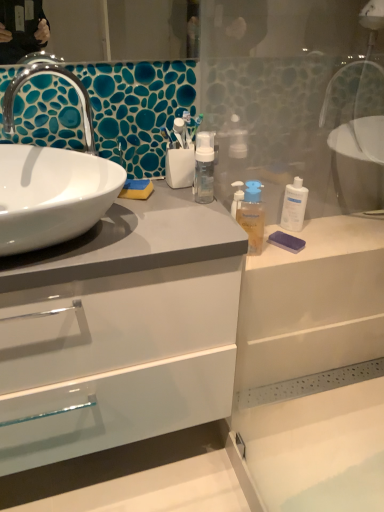
Question: From the image's perspective, does purple matte bar of soap at right appear lower than white glossy sink at left?

Choices:
 (A) no
 (B) yes

Answer: (B)

Question: Can you confirm if purple matte bar of soap at right is positioned to the left of white glossy sink at left?

Choices:
 (A) no
 (B) yes

Answer: (A)

Question: Is purple matte bar of soap at right closer to the viewer compared to white glossy sink at left?

Choices:
 (A) yes
 (B) no

Answer: (B)

Question: Does purple matte bar of soap at right have a greater height compared to white glossy sink at left?

Choices:
 (A) no
 (B) yes

Answer: (A)

Question: Does purple matte bar of soap at right have a lesser width compared to white glossy sink at left?

Choices:
 (A) no
 (B) yes

Answer: (B)

Question: Would you say white glossy cabinet at left is to the left or to the right of white glossy sink at left in the picture?

Choices:
 (A) left
 (B) right

Answer: (B)

Question: Is white glossy cabinet at left in front of or behind white glossy sink at left in the image?

Choices:
 (A) front
 (B) behind

Answer: (A)

Question: Is point (61, 373) closer or farther from the camera than point (89, 135)?

Choices:
 (A) farther
 (B) closer

Answer: (B)

Question: Is white glossy cabinet at left spatially inside white glossy sink at left, or outside of it?

Choices:
 (A) outside
 (B) inside

Answer: (A)

Question: Is point (74, 156) positioned closer to the camera than point (253, 219)?

Choices:
 (A) farther
 (B) closer

Answer: (B)

Question: From the image's perspective, is white glossy sink at left positioned above or below translucent plastic mouthwash at center, acting as the second mouthwash starting from the right?

Choices:
 (A) below
 (B) above

Answer: (B)

Question: Considering the positions of white glossy sink at left and translucent plastic mouthwash at center, the first mouthwash when ordered from front to back, in the image, is white glossy sink at left bigger or smaller than translucent plastic mouthwash at center, the first mouthwash when ordered from front to back,?

Choices:
 (A) small
 (B) big

Answer: (B)

Question: Is white glossy sink at left wider or thinner than translucent plastic mouthwash at center, the first mouthwash when ordered from front to back?

Choices:
 (A) wide
 (B) thin

Answer: (A)

Question: From the image's perspective, is white glossy sink at left above or below purple matte bar of soap at right?

Choices:
 (A) below
 (B) above

Answer: (B)

Question: From a real-world perspective, is white glossy sink at left above or below purple matte bar of soap at right?

Choices:
 (A) below
 (B) above

Answer: (B)